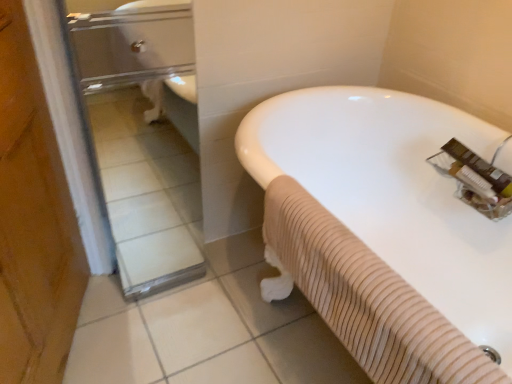
This screenshot has width=512, height=384. I want to click on vacant area that lies to the right of clear glass door at left, so click(x=237, y=283).